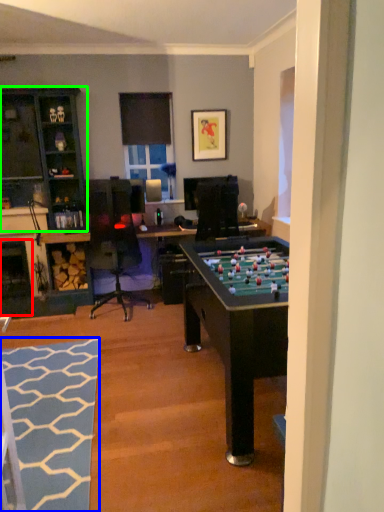
Question: Based on their relative distances, which object is farther from fireplace (highlighted by a red box)? Choose from flat (highlighted by a blue box) and cabinetry (highlighted by a green box).

Choices:
 (A) flat
 (B) cabinetry

Answer: (A)